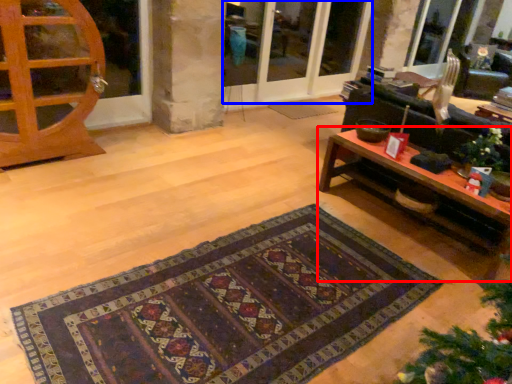
Question: Which of the following is the closest to the observer, table (highlighted by a red box) or screen door (highlighted by a blue box)?

Choices:
 (A) table
 (B) screen door

Answer: (A)